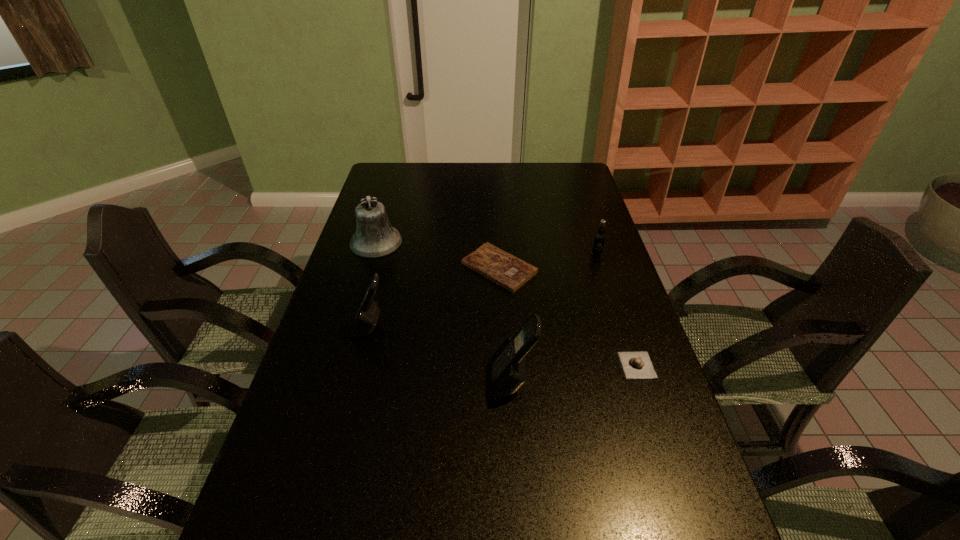
Image resolution: width=960 pixels, height=540 pixels. Find the location of `vacant area situated on the front-facing side of the taller cellular telephone`. vacant area situated on the front-facing side of the taller cellular telephone is located at coordinates (373, 383).

I want to click on blank space located on the front-facing side of the taller cellular telephone, so click(390, 383).

The width and height of the screenshot is (960, 540). Identify the location of vacant space located on the front-facing side of the taller cellular telephone. (467, 383).

This screenshot has width=960, height=540. I want to click on free space located on the label of the root beer, so click(604, 276).

You are a GUI agent. You are given a task and a screenshot of the screen. Output one action in this format:
    pyautogui.click(x=<x>, y=<y>)
    Task: Click on the vacant space located on the front of the Bible
    
    Given the screenshot: What is the action you would take?
    point(503,350)

In order to click on free space located on the back of the garlic in this screenshot , I will do (607, 275).

The image size is (960, 540). I want to click on vacant space situated on the back of the bell, so click(383, 218).

At what (x,y) coordinates should I click in order to perform the action: click on cellular telephone that is at the left edge. Please return your answer as a coordinate pair (x, y). Looking at the image, I should click on (366, 318).

Where is `bell located in the left edge section of the desktop`? The height and width of the screenshot is (540, 960). bell located in the left edge section of the desktop is located at coordinates (375, 237).

This screenshot has height=540, width=960. In order to click on root beer that is at the right edge in this screenshot , I will do `click(599, 239)`.